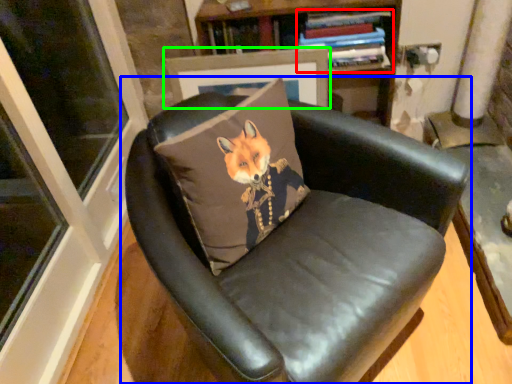
Question: Which object is positioned farthest from book (highlighted by a red box)? Select from chair (highlighted by a blue box) and picture frame (highlighted by a green box).

Choices:
 (A) chair
 (B) picture frame

Answer: (A)